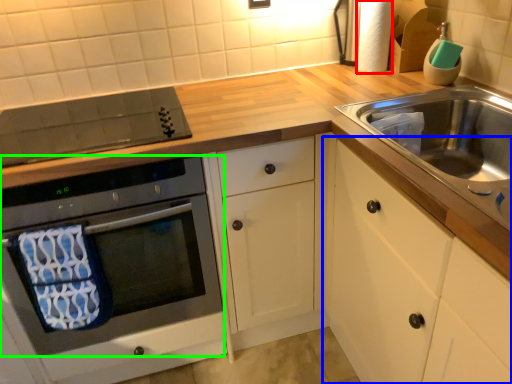
Question: Estimate the real-world distances between objects in this image. Which object is farther from toilet paper (highlighted by a red box), cabinetry (highlighted by a blue box) or oven (highlighted by a green box)?

Choices:
 (A) cabinetry
 (B) oven

Answer: (B)